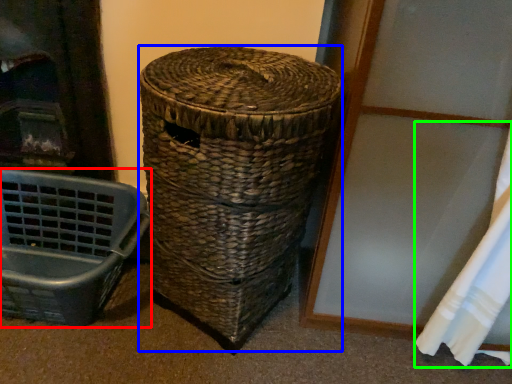
Question: Which object is positioned farthest from furniture (highlighted by a red box)? Select from basket (highlighted by a blue box) and curtain (highlighted by a green box).

Choices:
 (A) basket
 (B) curtain

Answer: (B)